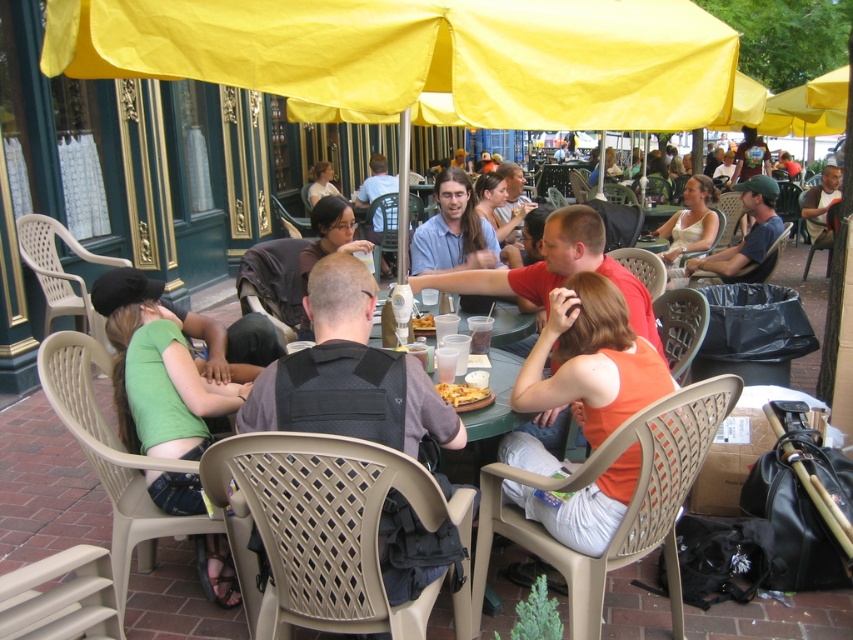
Which is more to the right, light brown hair at center or yellow matte pizza at center?

yellow matte pizza at center is more to the right.

Between point (323, 168) and point (424, 330), which one is positioned in front?

Point (424, 330) is in front.

Where is `light brown hair at center`? light brown hair at center is located at coordinates (321, 182).

Between green fabric shirt at center and light brown hair at center, which one is positioned lower?

Positioned lower is green fabric shirt at center.

Is green fabric shirt at center taller than light brown hair at center?

Yes.

Does point (717, 282) lie behind point (312, 196)?

No, it is in front of (312, 196).

Locate an element on the screen. This screenshot has width=853, height=640. green fabric shirt at center is located at coordinates (746, 234).

Which is in front, point (700, 200) or point (828, 168)?

Point (700, 200) is more forward.

Does point (706, 202) lie in front of point (809, 193)?

Yes, it is in front of point (809, 193).

Is point (697, 243) closer to camera compared to point (824, 198)?

Yes.

Image resolution: width=853 pixels, height=640 pixels. I want to click on white tank top at center, so click(x=691, y=220).